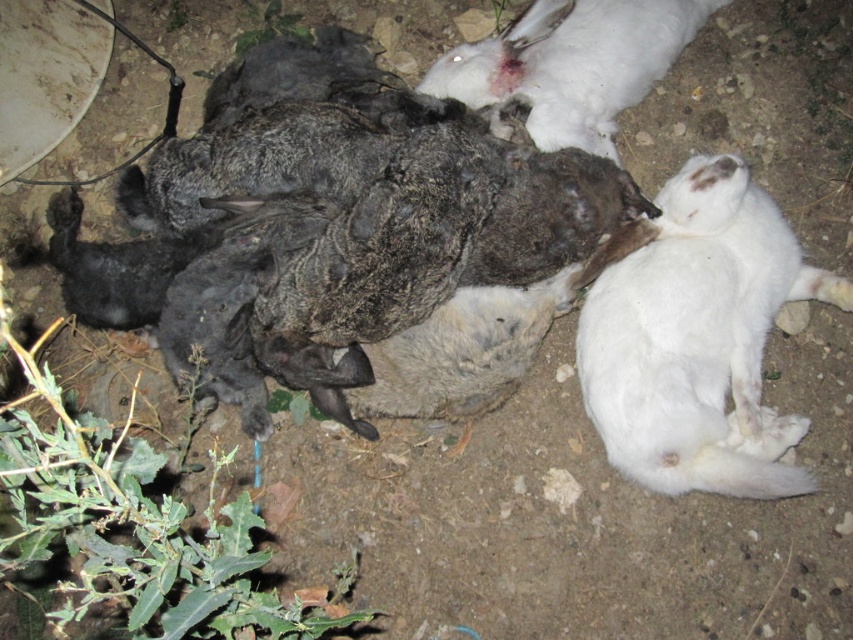
In the scene shown: You are a wildlife photographer trying to capture a closeup shot of the white fur rabbit at upper right. However, there is a white fur cat at right in the way. Can you tell me which animal is thinner so I can decide which one to move?

The white fur cat at right is thinner than the white fur rabbit at upper right, so you should move the cat to get a clear shot of the rabbit.

You are a photographer standing 2 meters away from a white fur cat at right. You want to take a closeup photo of the cat without moving closer. Can you do it with a standard zoom lens that has a maximum zoom of 200mm?

The white fur cat at right is 1.68 meters from viewer. Since you are 2 meters away, the cat is within the camera range. With a 200mm zoom lens, you can zoom in sufficiently to take a closeup photo without moving closer.

You are a photographer trying to capture a closeup of the white fur rabbit at upper right. However, you notice the white fur cat at right is blocking your view. Based on their positions, can you move to the left or right to get an unobstructed shot?

The white fur cat at right is to the right of the white fur rabbit at upper right. To avoid the cat, you should move to the left side to get an unobstructed view of the white fur rabbit at upper right.